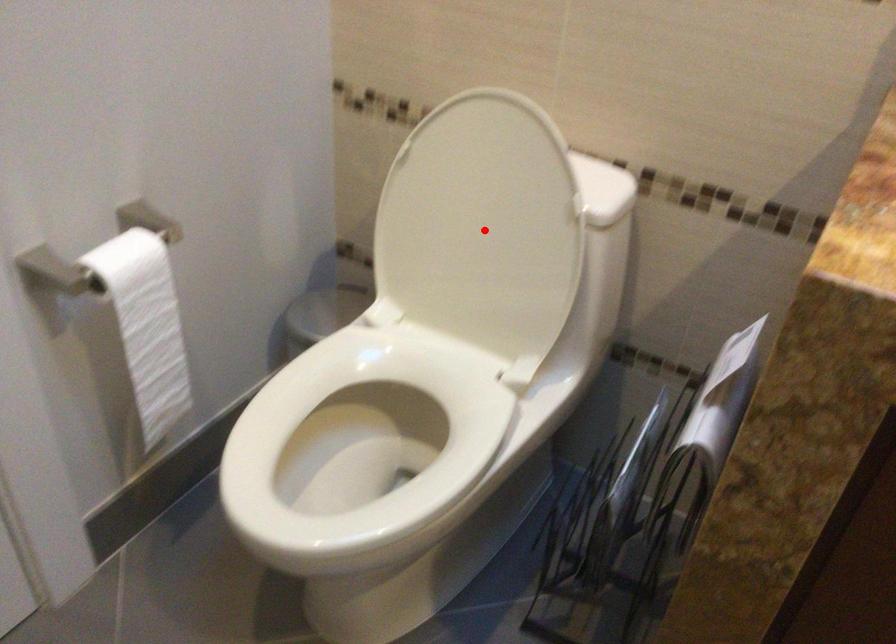
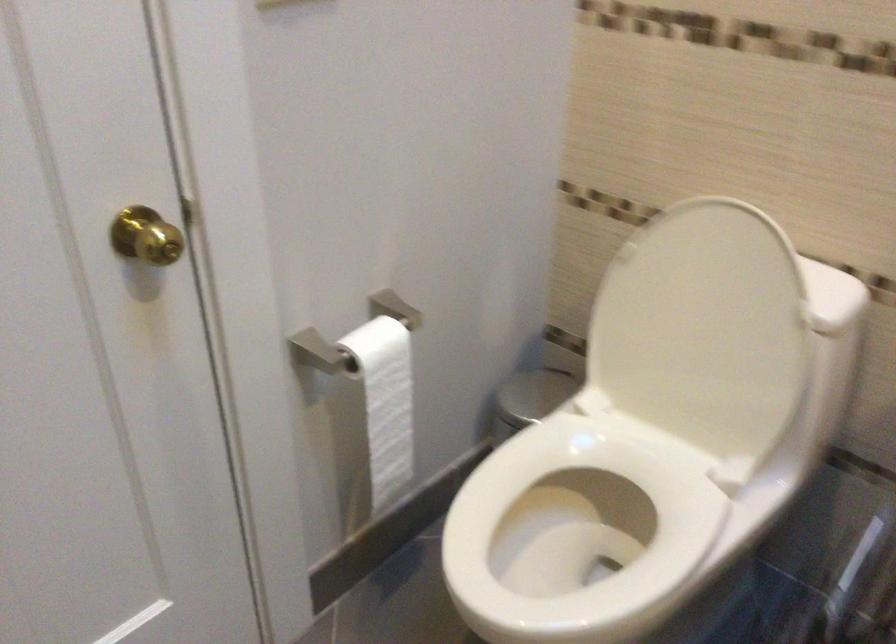
Where in the second image is the point corresponding to the highlighted location from the first image?

(702, 330)